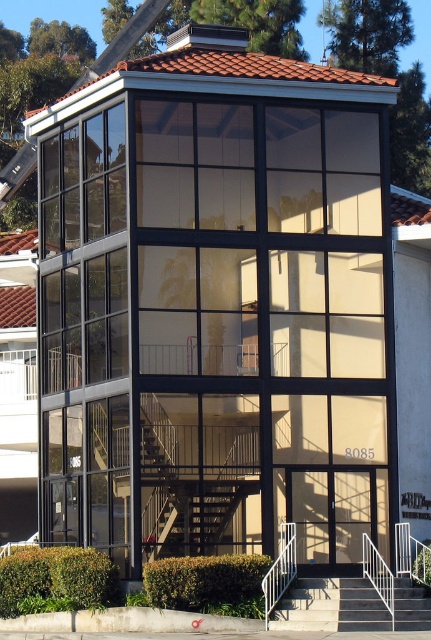
Question: Does concrete/steps at center appear under white metal railing at lower center?

Choices:
 (A) no
 (B) yes

Answer: (B)

Question: Which point appears closest to the camera in this image?

Choices:
 (A) (302, 609)
 (B) (274, 604)

Answer: (B)

Question: Does concrete/steps at center come in front of white metal railing at lower center?

Choices:
 (A) yes
 (B) no

Answer: (A)

Question: Considering the relative positions of concrete/steps at center and white metal railing at lower center in the image provided, where is concrete/steps at center located with respect to white metal railing at lower center?

Choices:
 (A) below
 (B) above

Answer: (A)